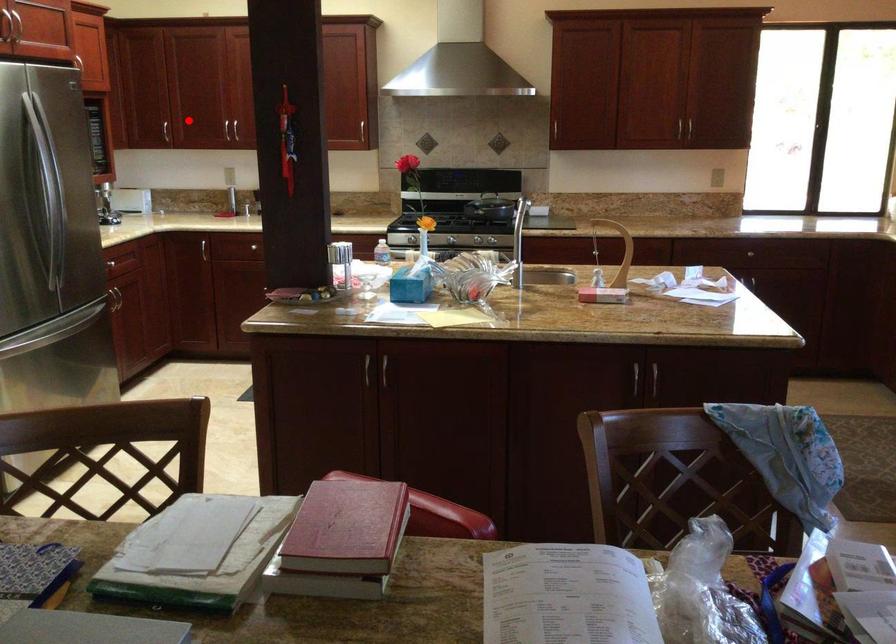
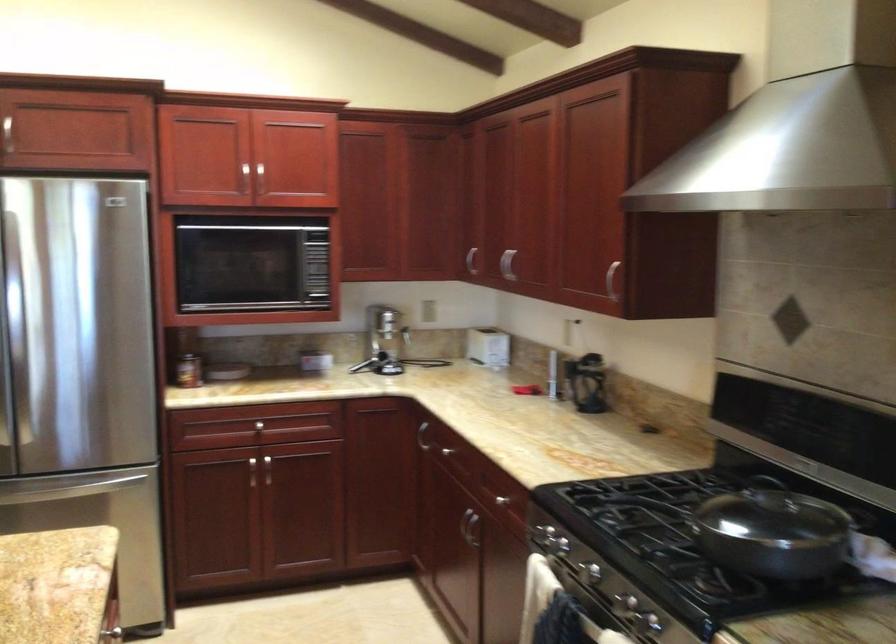
Question: I am providing you with two images of the same scene from different viewpoints. A red point is shown in image1. For the corresponding object point in image2, is it positioned nearer or farther from the camera?

Choices:
 (A) Nearer
 (B) Farther

Answer: (A)